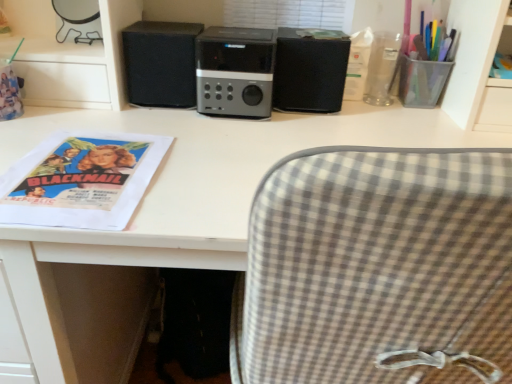
What is the approximate width of white matte desk at center?

22.89 inches.

Image resolution: width=512 pixels, height=384 pixels. What do you see at coordinates (383, 68) in the screenshot?
I see `clear plastic cup at upper right, acting as the first stationery starting from the left` at bounding box center [383, 68].

In order to click on black matte speaker at center, which is the 2th speaker from left to right in this screenshot , I will do `click(310, 70)`.

What is the approximate width of satin black speaker at center?

satin black speaker at center is 10.38 inches in width.

The width and height of the screenshot is (512, 384). Find the location of `black matte speaker at center, the 1th speaker when ordered from left to right`. black matte speaker at center, the 1th speaker when ordered from left to right is located at coordinates (161, 63).

At what (x,y) coordinates should I click in order to perform the action: click on white matte desk at center. Please return your answer as a coordinate pair (x, y). The height and width of the screenshot is (384, 512). Looking at the image, I should click on (168, 218).

Does white matte desk at center have a larger size compared to clear plastic cup at upper right, acting as the first stationery starting from the left?

Correct, white matte desk at center is larger in size than clear plastic cup at upper right, acting as the first stationery starting from the left.

Is white matte desk at center oriented towards clear plastic cup at upper right, the second stationery viewed from the right?

Yes, white matte desk at center is facing clear plastic cup at upper right, the second stationery viewed from the right.

From the image's perspective, is white matte desk at center above or below clear plastic cup at upper right, the second stationery viewed from the right?

From the image's perspective, white matte desk at center appears below clear plastic cup at upper right, the second stationery viewed from the right.

From the picture: Is white matte desk at center to the left or to the right of clear plastic cup at upper right, the second stationery viewed from the right, in the image?

white matte desk at center is to the left of clear plastic cup at upper right, the second stationery viewed from the right.

Does point (385, 82) come farther from viewer compared to point (126, 66)?

Yes, it is behind point (126, 66).

In the scene shown: Is clear plastic cup at upper right, the second stationery viewed from the right, not near black matte speaker at center, acting as the second speaker starting from the right?

That's not correct — clear plastic cup at upper right, the second stationery viewed from the right, is a little close to black matte speaker at center, acting as the second speaker starting from the right.

Considering the positions of objects clear plastic cup at upper right, the second stationery viewed from the right, and black matte speaker at center, the 1th speaker when ordered from left to right, in the image provided, who is behind, clear plastic cup at upper right, the second stationery viewed from the right, or black matte speaker at center, the 1th speaker when ordered from left to right,?

clear plastic cup at upper right, the second stationery viewed from the right, is further from the camera.

Considering the relative sizes of clear plastic cup at upper right, acting as the first stationery starting from the left, and black matte speaker at center, acting as the second speaker starting from the right, in the image provided, is clear plastic cup at upper right, acting as the first stationery starting from the left, shorter than black matte speaker at center, acting as the second speaker starting from the right,?

Yes.

Is black matte speaker at center, the 1th speaker when ordered from left to right, completely or partially inside transparent plastic cup at upper right, the 2th stationery when ordered from left to right?

No, transparent plastic cup at upper right, the 2th stationery when ordered from left to right, does not contain black matte speaker at center, the 1th speaker when ordered from left to right.

Is transparent plastic cup at upper right, which is the 1th stationery from right to left, positioned with its back to black matte speaker at center, acting as the second speaker starting from the right?

transparent plastic cup at upper right, which is the 1th stationery from right to left, is not turned away from black matte speaker at center, acting as the second speaker starting from the right.

Does transparent plastic cup at upper right, which is the 1th stationery from right to left, have a smaller size compared to black matte speaker at center, acting as the second speaker starting from the right?

Correct, transparent plastic cup at upper right, which is the 1th stationery from right to left, occupies less space than black matte speaker at center, acting as the second speaker starting from the right.

Considering the positions of objects transparent plastic cup at upper right, the 2th stationery when ordered from left to right, and black matte speaker at center, acting as the second speaker starting from the right, in the image provided, who is more to the left, transparent plastic cup at upper right, the 2th stationery when ordered from left to right, or black matte speaker at center, acting as the second speaker starting from the right,?

From the viewer's perspective, black matte speaker at center, acting as the second speaker starting from the right, appears more on the left side.

From the image's perspective, would you say clear plastic cup at upper right, acting as the first stationery starting from the left, is positioned over matte paper poster at left?

Correct, clear plastic cup at upper right, acting as the first stationery starting from the left, appears higher than matte paper poster at left in the image.

At what (x,y) coordinates should I click in order to perform the action: click on magazine on the left of clear plastic cup at upper right, acting as the first stationery starting from the left. Please return your answer as a coordinate pair (x, y). The image size is (512, 384). Looking at the image, I should click on (81, 180).

What's the angular difference between clear plastic cup at upper right, the second stationery viewed from the right, and matte paper poster at left's facing directions?

0.835 degrees.

Considering the positions of objects clear plastic cup at upper right, acting as the first stationery starting from the left, and matte paper poster at left in the image provided, who is more to the right, clear plastic cup at upper right, acting as the first stationery starting from the left, or matte paper poster at left?

From the viewer's perspective, clear plastic cup at upper right, acting as the first stationery starting from the left, appears more on the right side.

In terms of width, does satin black speaker at center look wider or thinner when compared to matte paper poster at left?

Considering their sizes, satin black speaker at center looks slimmer than matte paper poster at left.

From the image's perspective, who appears lower, satin black speaker at center or matte paper poster at left?

matte paper poster at left is shown below in the image.

Is matte paper poster at left completely or partially inside satin black speaker at center?

No, matte paper poster at left is located outside of satin black speaker at center.

Is black matte speaker at center, acting as the second speaker starting from the right, wider than satin black speaker at center?

In fact, black matte speaker at center, acting as the second speaker starting from the right, might be narrower than satin black speaker at center.

Does point (180, 51) come in front of point (215, 41)?

No, (180, 51) is behind (215, 41).

Are black matte speaker at center, the 1th speaker when ordered from left to right, and satin black speaker at center located far from each other?

No.

Choose the correct answer: Is clear plastic cup at upper right, the second stationery viewed from the right, inside white matte desk at center or outside it?

clear plastic cup at upper right, the second stationery viewed from the right, is not enclosed by white matte desk at center.

Is clear plastic cup at upper right, acting as the first stationery starting from the left, further to camera compared to white matte desk at center?

Yes, it is behind white matte desk at center.

Is white matte desk at center at the back of clear plastic cup at upper right, acting as the first stationery starting from the left?

No.

Where is `desk below the clear plastic cup at upper right, acting as the first stationery starting from the left (from the image's perspective)`? desk below the clear plastic cup at upper right, acting as the first stationery starting from the left (from the image's perspective) is located at coordinates (168, 218).

From a real-world perspective, starting from the white matte desk at center, which stationery is the 1st one vertically above it? Please provide its 2D coordinates.

[(383, 68)]

The height and width of the screenshot is (384, 512). I want to click on stationery that is behind the black matte speaker at center, the 1th speaker when ordered from left to right, so pyautogui.click(x=383, y=68).

Estimate the real-world distances between objects in this image. Which object is further from white matte desk at center, clear plastic cup at upper right, acting as the first stationery starting from the left, or black matte speaker at center, which is the first speaker in right-to-left order?

clear plastic cup at upper right, acting as the first stationery starting from the left, lies further to white matte desk at center than the other object.

Based on their spatial positions, is matte paper poster at left or white matte desk at center further from clear plastic cup at upper right, acting as the first stationery starting from the left?

matte paper poster at left.

From the image, which object appears to be farther from white matte desk at center, transparent plastic cup at upper right, the 2th stationery when ordered from left to right, or satin black speaker at center?

Based on the image, transparent plastic cup at upper right, the 2th stationery when ordered from left to right, appears to be further to white matte desk at center.

Estimate the real-world distances between objects in this image. Which object is closer to black matte speaker at center, which is the first speaker in right-to-left order, clear plastic cup at upper right, acting as the first stationery starting from the left, or matte paper poster at left?

Based on the image, clear plastic cup at upper right, acting as the first stationery starting from the left, appears to be nearer to black matte speaker at center, which is the first speaker in right-to-left order.

From the image, which object appears to be farther from white matte desk at center, satin black speaker at center or matte paper poster at left?

satin black speaker at center is further to white matte desk at center.

Estimate the real-world distances between objects in this image. Which object is closer to black matte speaker at center, which is the first speaker in right-to-left order, black matte speaker at center, acting as the second speaker starting from the right, or matte paper poster at left?

black matte speaker at center, acting as the second speaker starting from the right, is positioned closer to the anchor black matte speaker at center, which is the first speaker in right-to-left order.

Considering their positions, is matte paper poster at left positioned closer to black matte speaker at center, which is the first speaker in right-to-left order, than satin black speaker at center?

The object closer to black matte speaker at center, which is the first speaker in right-to-left order, is satin black speaker at center.

Which object lies further to the anchor point transparent plastic cup at upper right, the 2th stationery when ordered from left to right, white matte desk at center or satin black speaker at center?

white matte desk at center lies further to transparent plastic cup at upper right, the 2th stationery when ordered from left to right, than the other object.

Where is `stationery positioned between white matte desk at center and clear plastic cup at upper right, acting as the first stationery starting from the left, from near to far`? The image size is (512, 384). stationery positioned between white matte desk at center and clear plastic cup at upper right, acting as the first stationery starting from the left, from near to far is located at coordinates (x=426, y=68).

Where is `home appliance situated between matte paper poster at left and transparent plastic cup at upper right, which is the 1th stationery from right to left, from left to right`? The image size is (512, 384). home appliance situated between matte paper poster at left and transparent plastic cup at upper right, which is the 1th stationery from right to left, from left to right is located at coordinates (234, 71).

Where is `home appliance located between black matte speaker at center, the 1th speaker when ordered from left to right, and black matte speaker at center, which is the 2th speaker from left to right, in the left-right direction`? This screenshot has height=384, width=512. home appliance located between black matte speaker at center, the 1th speaker when ordered from left to right, and black matte speaker at center, which is the 2th speaker from left to right, in the left-right direction is located at coordinates (234, 71).

Identify the location of stationery situated between satin black speaker at center and transparent plastic cup at upper right, which is the 1th stationery from right to left, from left to right. The height and width of the screenshot is (384, 512). (383, 68).